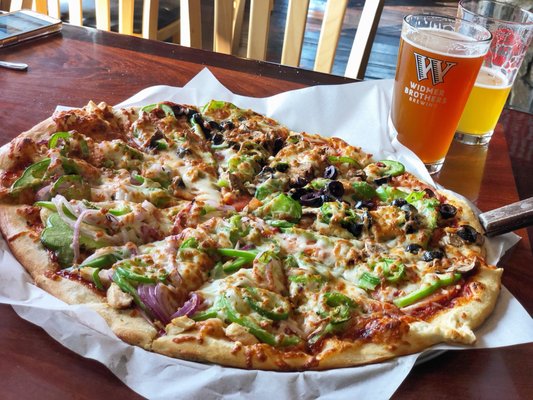
At what (x,y) coordinates should I click in order to perform the action: click on half-filled glass. Please return your answer as a coordinate pair (x, y). This screenshot has height=400, width=533. Looking at the image, I should click on (497, 66).